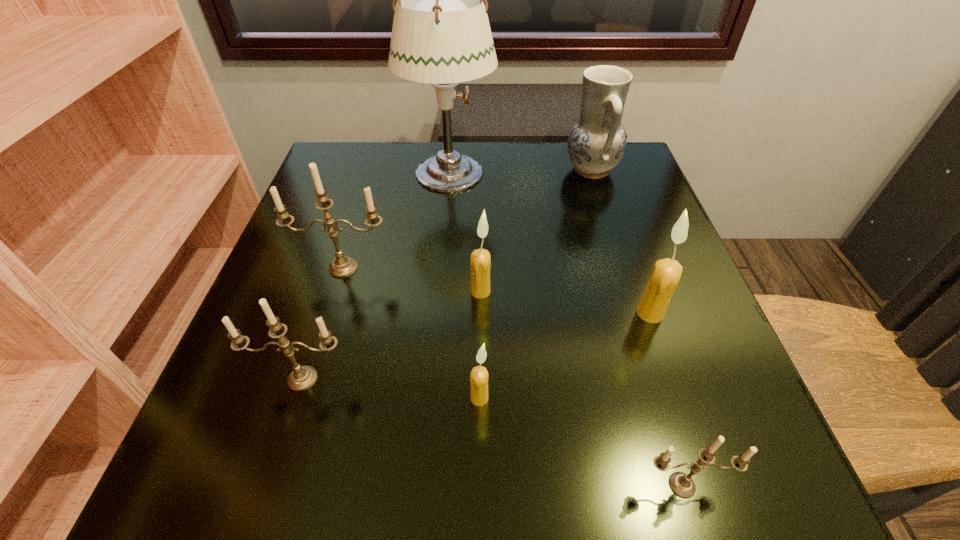
Where is `the tallest object`? the tallest object is located at coordinates (441, 35).

The height and width of the screenshot is (540, 960). Identify the location of blue pottery. (596, 143).

Find the location of a particular element. This screenshot has width=960, height=540. the biggest cream candle is located at coordinates (666, 273).

Locate an element on the screen. This screenshot has width=960, height=540. the second farthest cream candle is located at coordinates (666, 273).

Locate an element on the screen. This screenshot has width=960, height=540. the farthest candle is located at coordinates (343, 266).

Locate an element on the screen. the sixth nearest object is located at coordinates (343, 266).

The height and width of the screenshot is (540, 960). Find the location of `the fourth farthest object`. the fourth farthest object is located at coordinates (480, 263).

Locate an element on the screen. the fifth nearest candle is located at coordinates (480, 263).

Identify the location of the second biggest metallic candle. This screenshot has width=960, height=540. (301, 378).

Find the location of `the smallest cream candle`. the smallest cream candle is located at coordinates (479, 376).